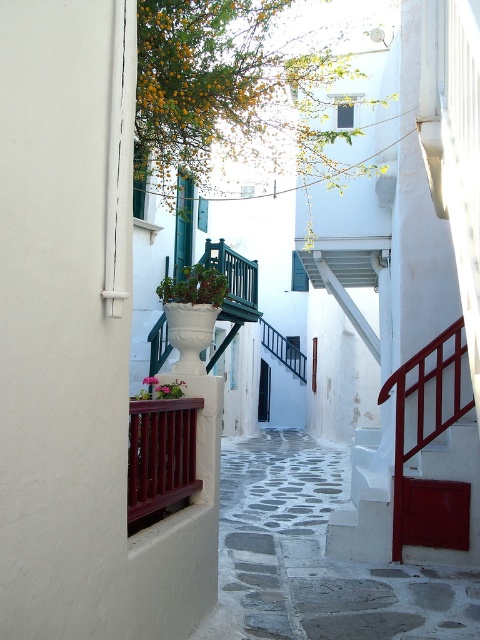
Question: Is wooden balustrade at lower left thinner than green matte planter at center?

Choices:
 (A) no
 (B) yes

Answer: (B)

Question: Estimate the real-world distances between objects in this image. Which object is farther from the wooden balustrade at lower left?

Choices:
 (A) metallic red railing at center
 (B) green matte planter at center

Answer: (A)

Question: Does wooden balustrade at lower left appear over matte white pot at center?

Choices:
 (A) no
 (B) yes

Answer: (A)

Question: Which object is farther from the camera taking this photo?

Choices:
 (A) green matte planter at center
 (B) wooden balustrade at lower left

Answer: (A)

Question: Is wooden balustrade at lower left wider than metallic red railing at center?

Choices:
 (A) no
 (B) yes

Answer: (A)

Question: Estimate the real-world distances between objects in this image. Which object is farther from the matte white pot at center?

Choices:
 (A) green matte planter at center
 (B) wooden balustrade at lower left

Answer: (A)